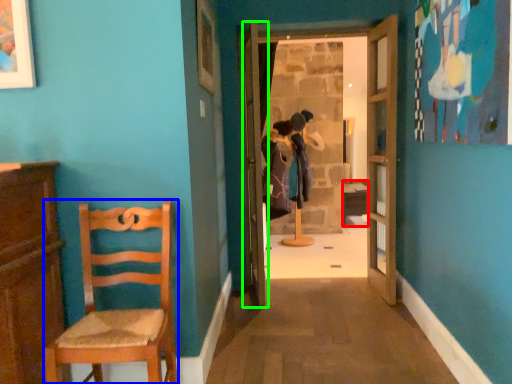
Question: Which is farther away from table (highlighted by a red box)? chair (highlighted by a blue box) or door (highlighted by a green box)?

Choices:
 (A) chair
 (B) door

Answer: (A)